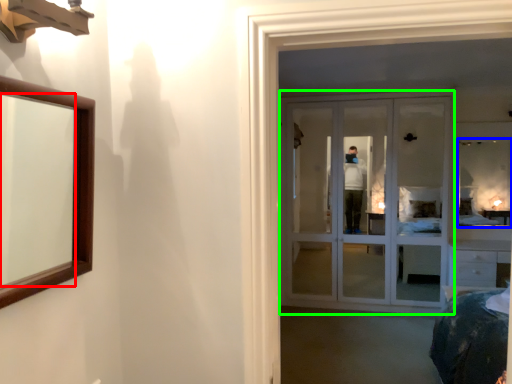
Question: Based on their relative distances, which object is farther from mirror (highlighted by a red box)? Choose from mirror (highlighted by a blue box) and door (highlighted by a green box).

Choices:
 (A) mirror
 (B) door

Answer: (A)